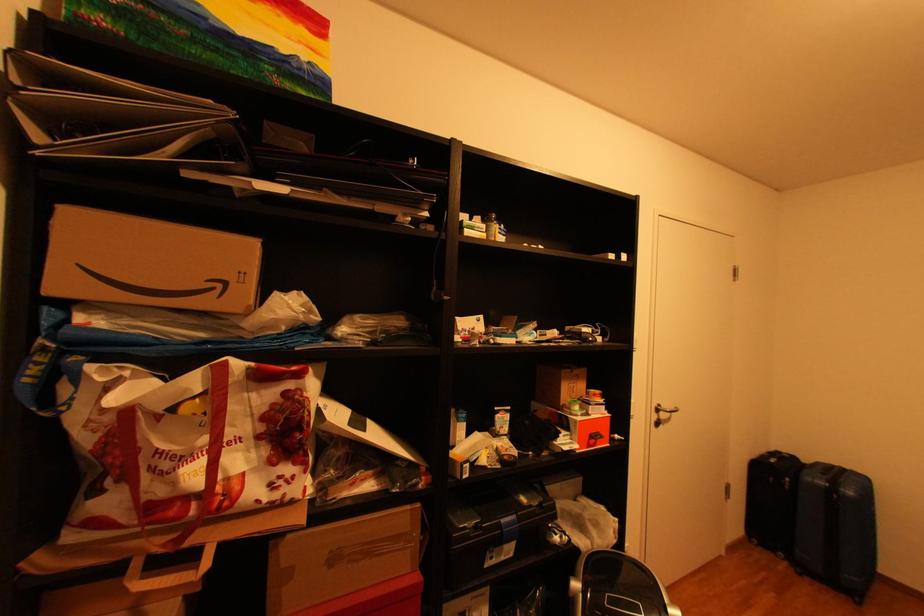
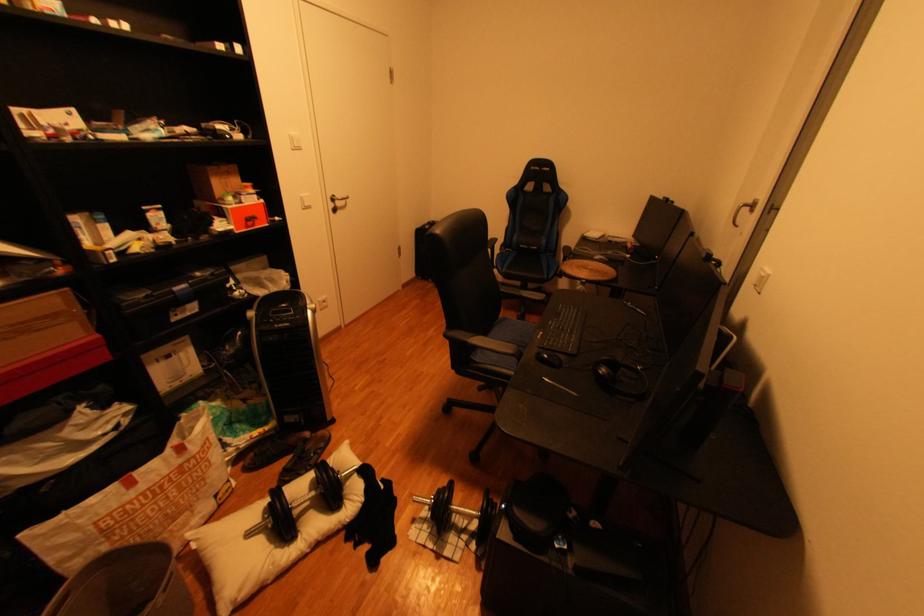
The point at [670,406] is marked in the first image. Where is the corresponding point in the second image?

(345, 197)